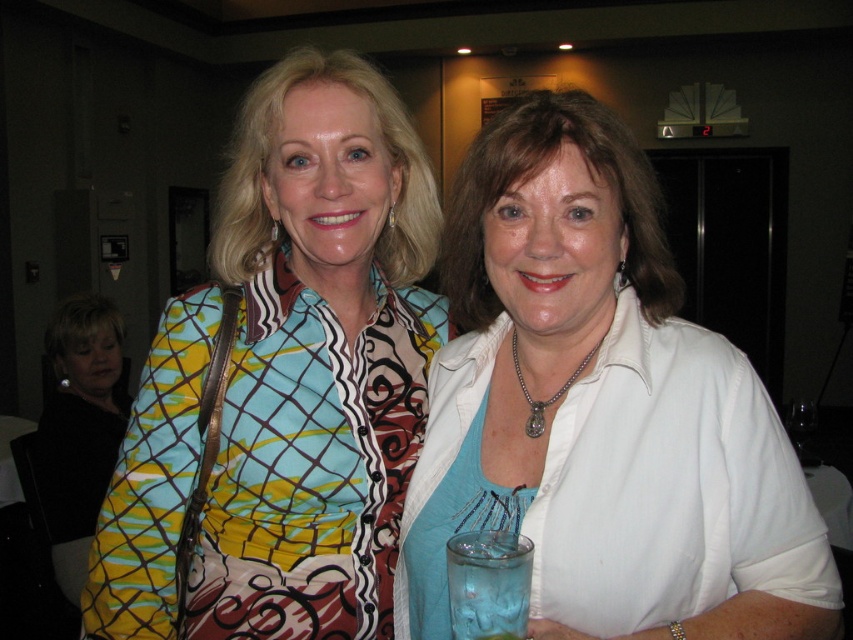
Is point (482, 305) positioned before point (496, 611)?

No, (482, 305) is further to viewer.

Image resolution: width=853 pixels, height=640 pixels. In order to click on white glossy shirt at center in this screenshot , I will do `click(601, 410)`.

Which is in front, point (300, 579) or point (459, 628)?

Positioned in front is point (459, 628).

Does printed fabric blouse at center appear on the right side of transparent glass at center?

In fact, printed fabric blouse at center is to the left of transparent glass at center.

Which is behind, point (187, 428) or point (512, 620)?

The point (187, 428) is more distant.

The height and width of the screenshot is (640, 853). Find the location of `printed fabric blouse at center`. printed fabric blouse at center is located at coordinates (283, 381).

Which is above, white glossy shirt at center or printed fabric blouse at center?

printed fabric blouse at center is higher up.

What do you see at coordinates (601, 410) in the screenshot?
I see `white glossy shirt at center` at bounding box center [601, 410].

You are a GUI agent. You are given a task and a screenshot of the screen. Output one action in this format:
    pyautogui.click(x=<x>, y=<y>)
    Task: Click on the white glossy shirt at center
    
    Given the screenshot: What is the action you would take?
    pyautogui.click(x=601, y=410)